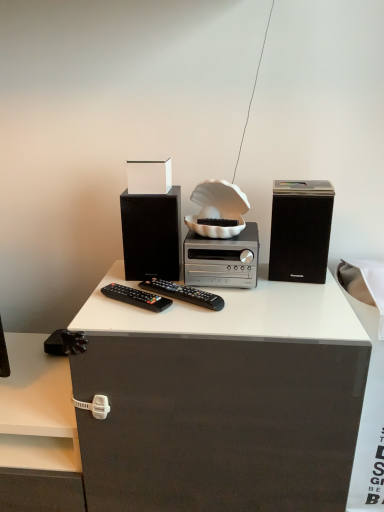
Question: Looking at their shapes, would you say black matte speaker at right, which is the 2th speaker in left-to-right order, is wider or thinner than matte black cabinet at right?

Choices:
 (A) thin
 (B) wide

Answer: (A)

Question: Is point (321, 183) positioned closer to the camera than point (357, 484)?

Choices:
 (A) farther
 (B) closer

Answer: (B)

Question: Estimate the real-world distances between objects in this image. Which object is farther from the black matte speaker at right, which is the 2th speaker in left-to-right order?

Choices:
 (A) matte black cabinet at right
 (B) matte black speaker at center, the first speaker viewed from the left
 (C) black plastic remote at center, placed as the second remote control when sorted from left to right
 (D) silver metallic stereo at center
 (E) black plastic remote at center, which is the 2th remote control in right-to-left order

Answer: (E)

Question: Which object is the farthest from the matte black speaker at center, which is the second speaker in right-to-left order?

Choices:
 (A) silver metallic stereo at center
 (B) black plastic remote at center, the first remote control from the left
 (C) black plastic remote at center, marked as the first remote control in a right-to-left arrangement
 (D) black matte speaker at right, which is the 2th speaker in left-to-right order
 (E) matte black cabinet at right

Answer: (E)